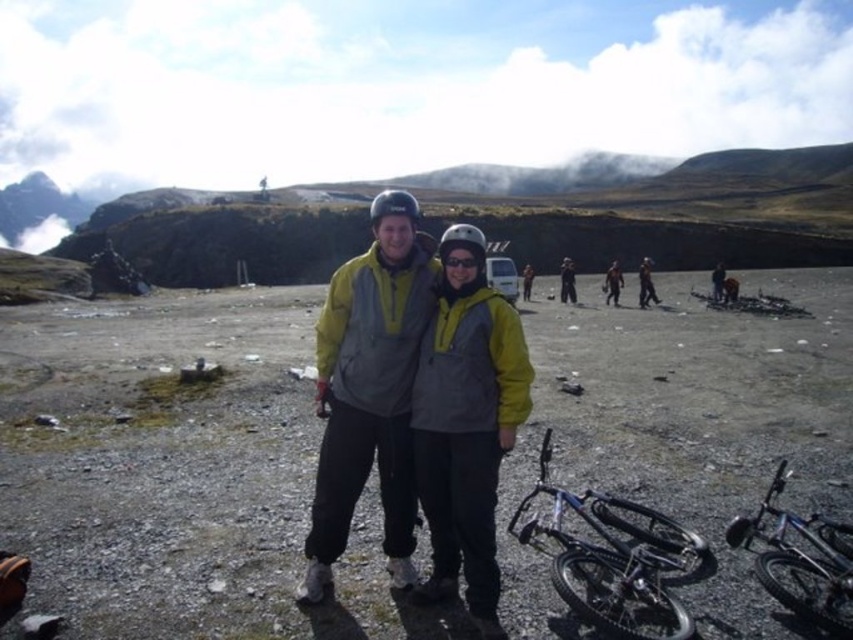
Is yellow/grey fabric jacket at center thinner than black matte goggles at center?

In fact, yellow/grey fabric jacket at center might be wider than black matte goggles at center.

Who is more forward, (335, 396) or (457, 257)?

Point (335, 396)

Where is `yellow/grey fabric jacket at center`? This screenshot has width=853, height=640. yellow/grey fabric jacket at center is located at coordinates (372, 388).

Can you confirm if rugged brown mountain at center is positioned to the left of black matte goggles at center?

In fact, rugged brown mountain at center is to the right of black matte goggles at center.

Is point (274, 273) in front of point (444, 257)?

No.

The image size is (853, 640). Find the location of `rugged brown mountain at center`. rugged brown mountain at center is located at coordinates point(677,212).

At what (x,y) coordinates should I click in order to perform the action: click on rugged brown mountain at center. Please return your answer as a coordinate pair (x, y). Looking at the image, I should click on (677, 212).

Is silver metallic bicycle at lower right taller than black matte goggles at center?

No, silver metallic bicycle at lower right is not taller than black matte goggles at center.

Can you confirm if silver metallic bicycle at lower right is positioned to the left of black matte goggles at center?

In fact, silver metallic bicycle at lower right is to the right of black matte goggles at center.

Measure the distance between silver metallic bicycle at lower right and camera.

silver metallic bicycle at lower right and camera are 61.98 feet apart from each other.

The width and height of the screenshot is (853, 640). In order to click on silver metallic bicycle at lower right in this screenshot , I will do `click(611, 560)`.